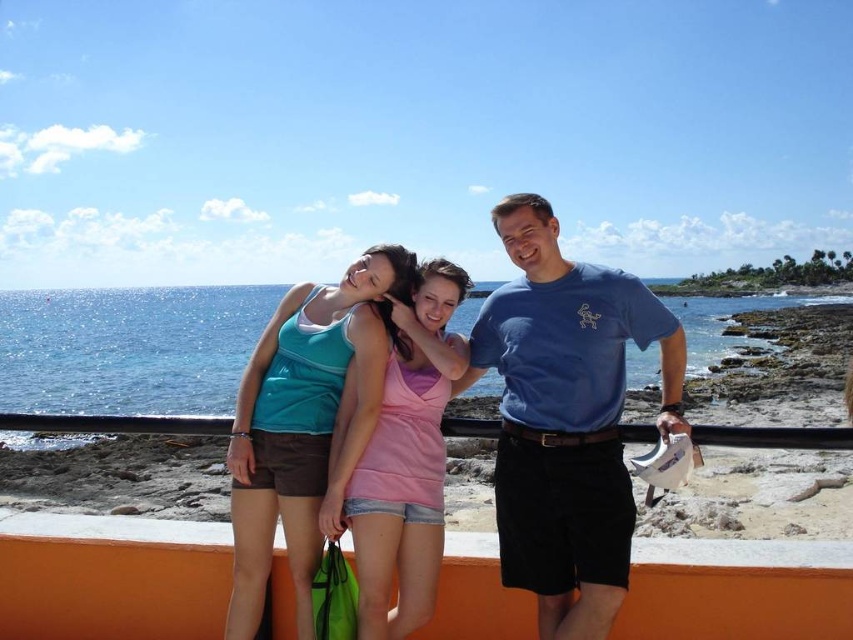
Between orange concrete ledge at lower center and pink fabric tank top at center, which one appears on the left side from the viewer's perspective?

From the viewer's perspective, pink fabric tank top at center appears more on the left side.

Based on the photo, does orange concrete ledge at lower center have a smaller size compared to pink fabric tank top at center?

Yes.

Does point (447, 600) come closer to viewer compared to point (386, 416)?

Yes.

Locate an element on the screen. This screenshot has height=640, width=853. orange concrete ledge at lower center is located at coordinates (109, 577).

Does blue cotton t-shirt at center appear over pink fabric tank top at center?

Indeed, blue cotton t-shirt at center is positioned over pink fabric tank top at center.

Is blue cotton t-shirt at center to the left of pink fabric tank top at center from the viewer's perspective?

No, blue cotton t-shirt at center is not to the left of pink fabric tank top at center.

The image size is (853, 640). What do you see at coordinates (566, 417) in the screenshot? I see `blue cotton t-shirt at center` at bounding box center [566, 417].

Locate an element on the screen. Image resolution: width=853 pixels, height=640 pixels. blue cotton t-shirt at center is located at coordinates (566, 417).

Does orange concrete ledge at lower center have a larger size compared to matte teal tank top at center?

No.

Where is `orange concrete ledge at lower center`? This screenshot has height=640, width=853. orange concrete ledge at lower center is located at coordinates (109, 577).